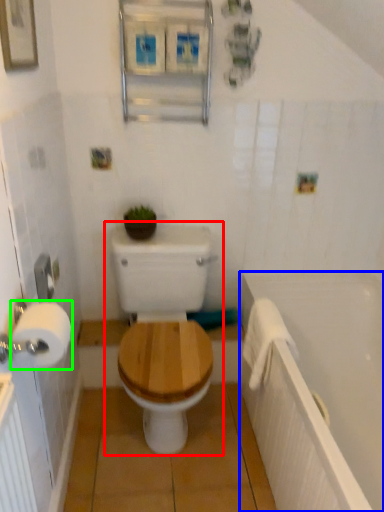
Question: Which is farther away from toilet (highlighted by a red box)? bath (highlighted by a blue box) or toilet paper (highlighted by a green box)?

Choices:
 (A) bath
 (B) toilet paper

Answer: (B)